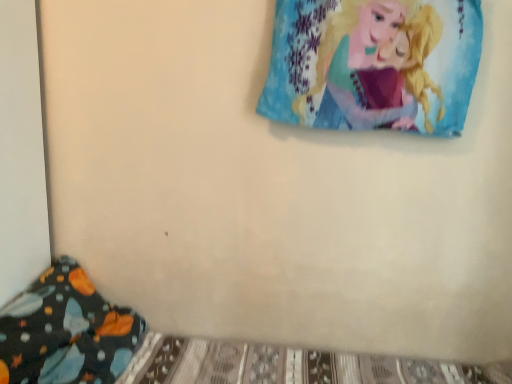
Image resolution: width=512 pixels, height=384 pixels. I want to click on blue fabric pillow at upper right, so click(377, 64).

This screenshot has height=384, width=512. Describe the element at coordinates (377, 64) in the screenshot. I see `blue fabric pillow at upper right` at that location.

The image size is (512, 384). In order to click on dark blue fabric pillow at lower left in this screenshot , I will do `click(65, 331)`.

The image size is (512, 384). Describe the element at coordinates (65, 331) in the screenshot. I see `dark blue fabric pillow at lower left` at that location.

At what (x,y) coordinates should I click in order to perform the action: click on blue fabric pillow at upper right. Please return your answer as a coordinate pair (x, y). This screenshot has height=384, width=512. Looking at the image, I should click on (377, 64).

Considering the positions of objects dark blue fabric pillow at lower left and blue fabric pillow at upper right in the image provided, who is more to the right, dark blue fabric pillow at lower left or blue fabric pillow at upper right?

blue fabric pillow at upper right.

Between dark blue fabric pillow at lower left and blue fabric pillow at upper right, which one is positioned in front?

Positioned in front is dark blue fabric pillow at lower left.

Which is closer, (x=127, y=344) or (x=338, y=33)?

Clearly, point (x=127, y=344) is more distant from the camera than point (x=338, y=33).

Consider the image. From the image's perspective, is dark blue fabric pillow at lower left located beneath blue fabric pillow at upper right?

Indeed, from the image's perspective, dark blue fabric pillow at lower left is shown beneath blue fabric pillow at upper right.

From a real-world perspective, which is physically above, dark blue fabric pillow at lower left or blue fabric pillow at upper right?

From a 3D spatial view, blue fabric pillow at upper right is above.

In terms of width, does dark blue fabric pillow at lower left look wider or thinner when compared to blue fabric pillow at upper right?

Clearly, dark blue fabric pillow at lower left has more width compared to blue fabric pillow at upper right.

Between dark blue fabric pillow at lower left and blue fabric pillow at upper right, which one has more height?

With more height is dark blue fabric pillow at lower left.

Who is smaller, dark blue fabric pillow at lower left or blue fabric pillow at upper right?

Smaller between the two is blue fabric pillow at upper right.

From the picture: Is dark blue fabric pillow at lower left inside or outside of blue fabric pillow at upper right?

dark blue fabric pillow at lower left is located beyond the bounds of blue fabric pillow at upper right.

Are dark blue fabric pillow at lower left and blue fabric pillow at upper right far apart?

Yes, dark blue fabric pillow at lower left and blue fabric pillow at upper right are located far from each other.

Could you tell me if dark blue fabric pillow at lower left is facing blue fabric pillow at upper right?

No.

How different are the orientations of dark blue fabric pillow at lower left and blue fabric pillow at upper right in degrees?

The angle between the facing direction of dark blue fabric pillow at lower left and the facing direction of blue fabric pillow at upper right is 79.7 degrees.

Identify the location of person above the dark blue fabric pillow at lower left (from a real-world perspective). This screenshot has height=384, width=512. (377, 64).

Between blue fabric pillow at upper right and dark blue fabric pillow at lower left, which one appears on the left side from the viewer's perspective?

dark blue fabric pillow at lower left.

Considering the positions of objects blue fabric pillow at upper right and dark blue fabric pillow at lower left in the image provided, who is behind, blue fabric pillow at upper right or dark blue fabric pillow at lower left?

blue fabric pillow at upper right is further from the camera.

Between point (369, 75) and point (0, 366), which one is positioned in front?

Point (0, 366)

From the image's perspective, between blue fabric pillow at upper right and dark blue fabric pillow at lower left, who is located below?

From the image's view, dark blue fabric pillow at lower left is below.

From a real-world perspective, who is located higher, blue fabric pillow at upper right or dark blue fabric pillow at lower left?

blue fabric pillow at upper right is physically above.

Looking at their sizes, would you say blue fabric pillow at upper right is wider or thinner than dark blue fabric pillow at lower left?

In the image, blue fabric pillow at upper right appears to be more narrow than dark blue fabric pillow at lower left.

Considering the sizes of objects blue fabric pillow at upper right and dark blue fabric pillow at lower left in the image provided, who is taller, blue fabric pillow at upper right or dark blue fabric pillow at lower left?

With more height is dark blue fabric pillow at lower left.

Can you confirm if blue fabric pillow at upper right is bigger than dark blue fabric pillow at lower left?

Actually, blue fabric pillow at upper right might be smaller than dark blue fabric pillow at lower left.

Would you say dark blue fabric pillow at lower left is part of blue fabric pillow at upper right's contents?

No.

In the scene shown: Would you consider blue fabric pillow at upper right to be distant from dark blue fabric pillow at lower left?

Yes.

Could you tell me if blue fabric pillow at upper right is turned towards dark blue fabric pillow at lower left?

No, blue fabric pillow at upper right is not aimed at dark blue fabric pillow at lower left.

I want to click on person behind the dark blue fabric pillow at lower left, so click(377, 64).

Where is `person above the dark blue fabric pillow at lower left (from the image's perspective)`? person above the dark blue fabric pillow at lower left (from the image's perspective) is located at coordinates (377, 64).

You are a GUI agent. You are given a task and a screenshot of the screen. Output one action in this format:
    pyautogui.click(x=<x>, y=<y>)
    Task: Click on the person behind the dark blue fabric pillow at lower left
    Image resolution: width=512 pixels, height=384 pixels.
    Given the screenshot: What is the action you would take?
    pyautogui.click(x=377, y=64)